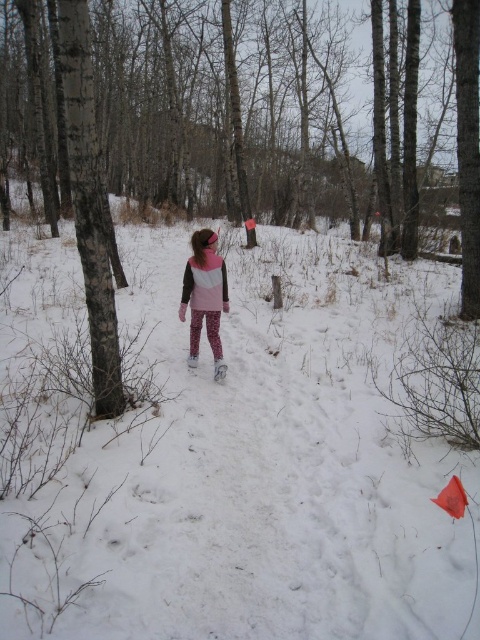
Question: Among these objects, which one is nearest to the camera?

Choices:
 (A) white fluffy snow at center
 (B) brown bark tree at center
 (C) pink matte jacket at center

Answer: (A)

Question: Does white fluffy snow at center appear over pink matte jacket at center?

Choices:
 (A) no
 (B) yes

Answer: (A)

Question: Which point appears farthest from the camera in this image?

Choices:
 (A) (175, 129)
 (B) (215, 232)
 (C) (220, 452)

Answer: (A)

Question: Can you confirm if brown bark tree at center is positioned below pink matte jacket at center?

Choices:
 (A) yes
 (B) no

Answer: (B)

Question: Is white fluffy snow at center further to camera compared to pink matte jacket at center?

Choices:
 (A) no
 (B) yes

Answer: (A)

Question: Which point is closer to the camera taking this photo?

Choices:
 (A) (235, 204)
 (B) (211, 300)
 (C) (283, 236)

Answer: (B)